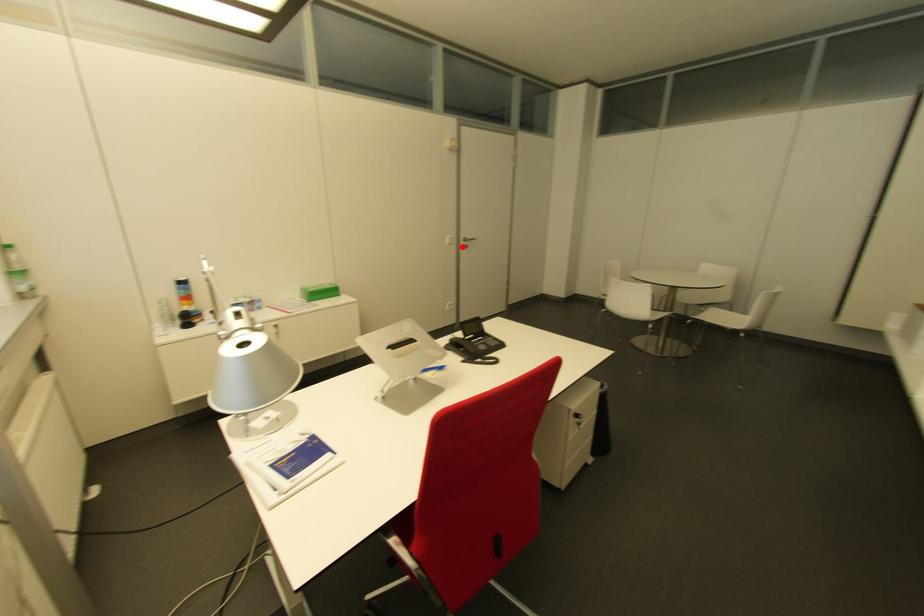
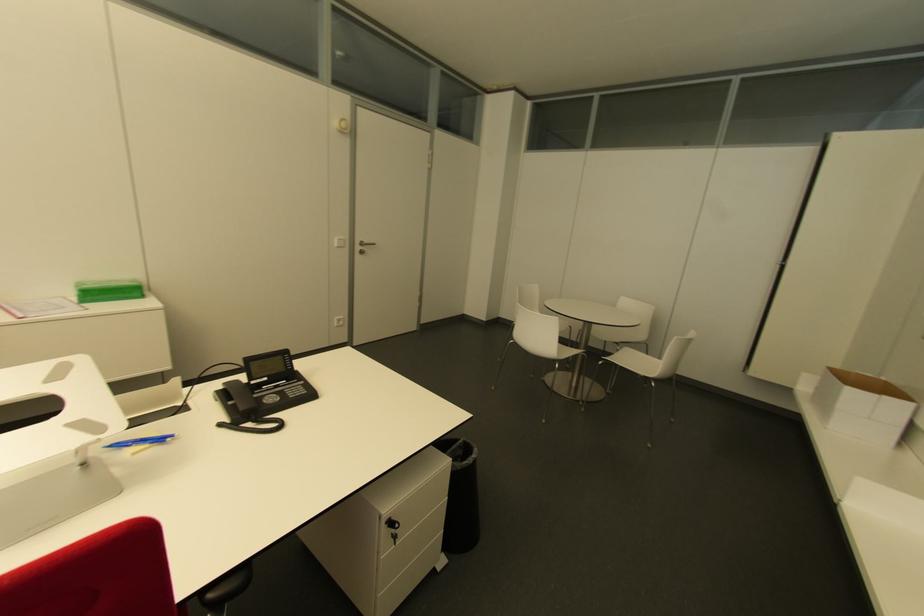
Locate, in the second image, the point that corresponds to the highlighted location in the first image.

(360, 253)